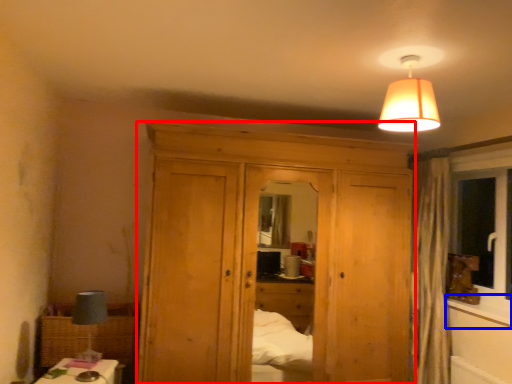
Question: Among these objects, which one is nearest to the camera, dresser (highlighted by a red box) or window sill (highlighted by a blue box)?

Choices:
 (A) dresser
 (B) window sill

Answer: (A)